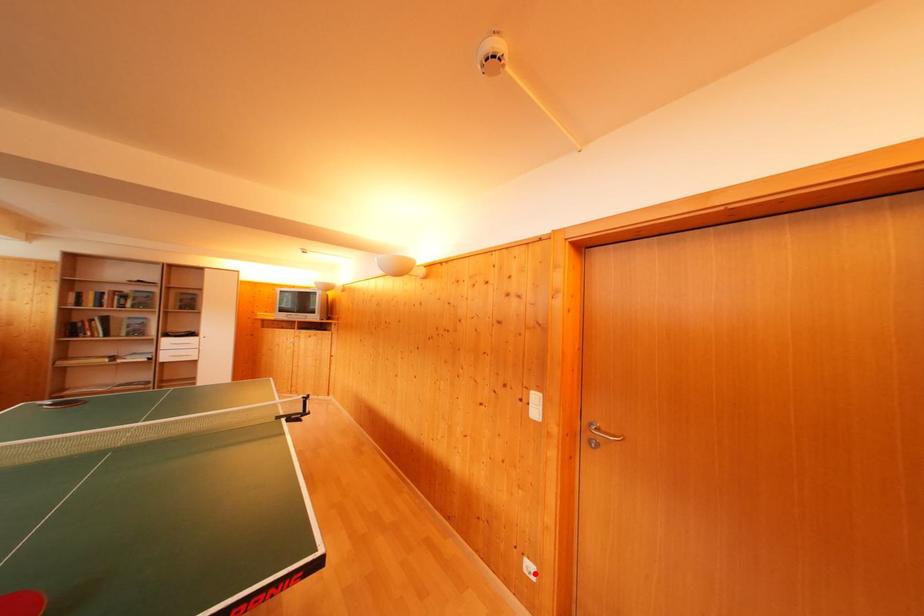
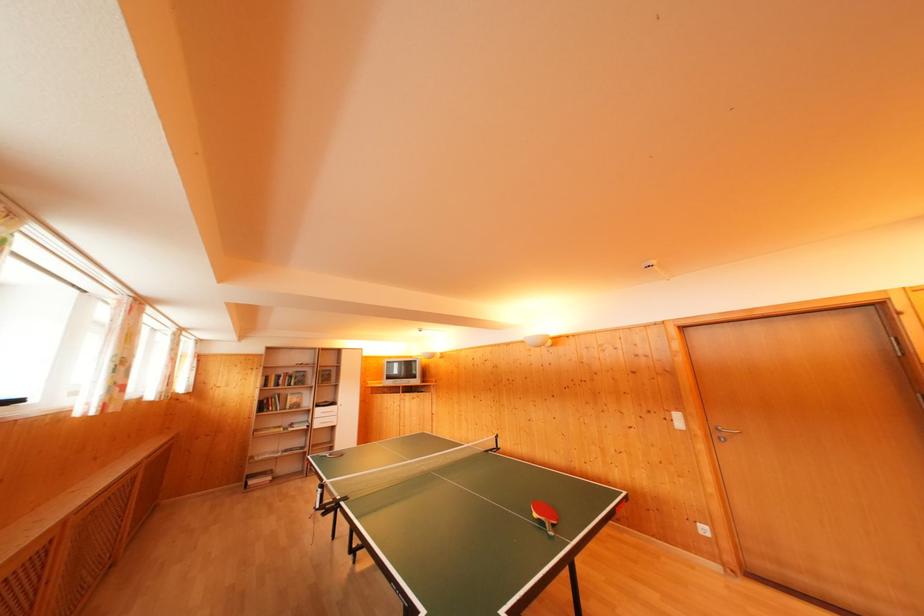
Question: I am providing you with two images of the same scene from different viewpoints. Image1 has a red point marked. In image2, the corresponding 3D location appears at what relative position? Reply with the corresponding letter.

Choices:
 (A) Closer
 (B) Farther

Answer: (A)